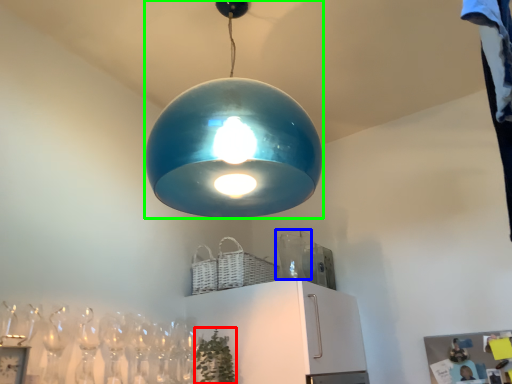
Question: Estimate the real-world distances between objects in this image. Which object is farther from plant (highlighted by a red box), glass vase (highlighted by a blue box) or lamp (highlighted by a green box)?

Choices:
 (A) glass vase
 (B) lamp

Answer: (B)